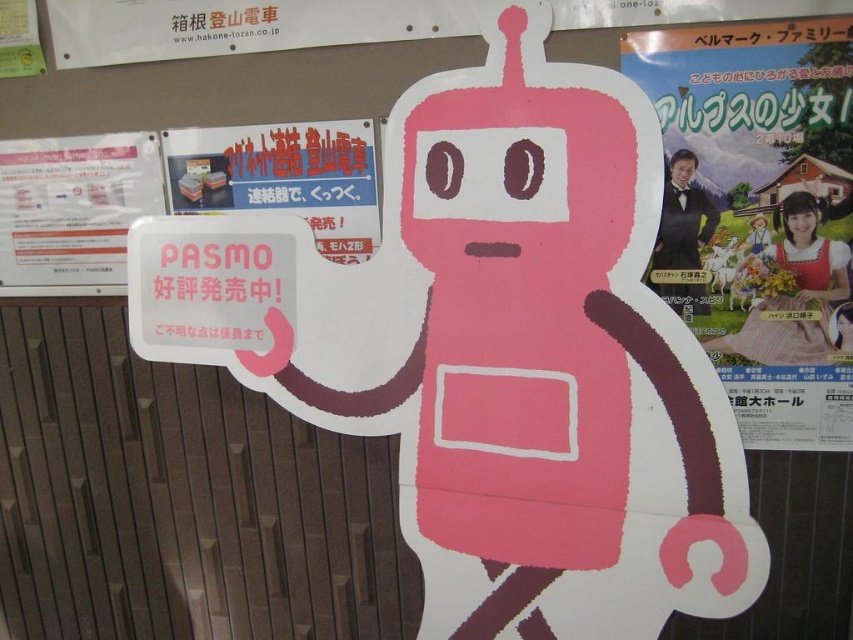
In the scene shown: You are a visitor at a train station and see the matte paper poster at right and the matte paper sign at upper left on the wall. Which one do you think is larger in size?

The matte paper poster at right is bigger than the matte paper sign at upper left.